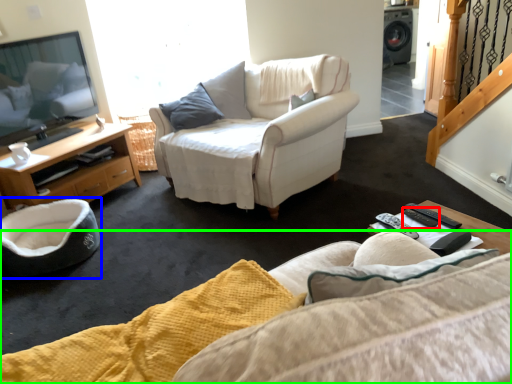
Question: Based on their relative distances, which object is nearer to remote (highlighted by a red box)? Choose from swivel chair (highlighted by a blue box) and studio couch (highlighted by a green box).

Choices:
 (A) swivel chair
 (B) studio couch

Answer: (B)